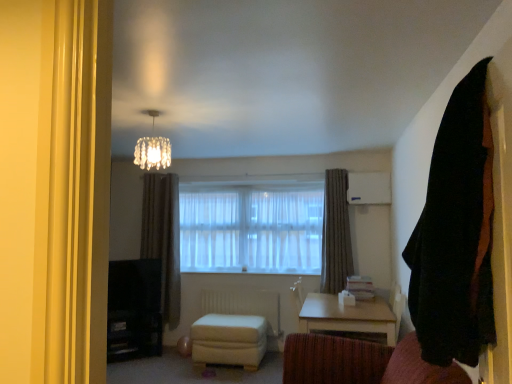
Question: Is white plastic radiator at lower center next to white sheer curtains at center and touching it?

Choices:
 (A) no
 (B) yes

Answer: (A)

Question: Considering the relative sizes of white plastic radiator at lower center and white sheer curtains at center in the image provided, is white plastic radiator at lower center taller than white sheer curtains at center?

Choices:
 (A) yes
 (B) no

Answer: (B)

Question: From a real-world perspective, is white plastic radiator at lower center located higher than white sheer curtains at center?

Choices:
 (A) no
 (B) yes

Answer: (A)

Question: Considering the relative sizes of white plastic radiator at lower center and white sheer curtains at center in the image provided, is white plastic radiator at lower center thinner than white sheer curtains at center?

Choices:
 (A) yes
 (B) no

Answer: (A)

Question: Does white plastic radiator at lower center turn towards white sheer curtains at center?

Choices:
 (A) no
 (B) yes

Answer: (A)

Question: From a real-world perspective, is gray textured curtain at center, the second curtain in the front-to-back sequence, above or below dark gray textured curtain at left, placed as the first curtain when sorted from back to front?

Choices:
 (A) below
 (B) above

Answer: (B)

Question: Based on their positions, is gray textured curtain at center, the second curtain in the front-to-back sequence, located to the left or right of dark gray textured curtain at left, the 3th curtain in the front-to-back sequence?

Choices:
 (A) right
 (B) left

Answer: (A)

Question: In the image, is gray textured curtain at center, which is the 1th curtain in right-to-left order, positioned in front of or behind dark gray textured curtain at left, the 3th curtain in the front-to-back sequence?

Choices:
 (A) behind
 (B) front

Answer: (B)

Question: From the image's perspective, is gray textured curtain at center, which is the 1th curtain in right-to-left order, positioned above or below dark gray textured curtain at left, the third curtain from the right?

Choices:
 (A) above
 (B) below

Answer: (A)

Question: From the image's perspective, is white leather stool at center positioned above or below black fabric curtain at right, the second curtain when ordered from left to right?

Choices:
 (A) below
 (B) above

Answer: (A)

Question: Considering the positions of white leather stool at center and black fabric curtain at right, the second curtain viewed from the right, in the image, is white leather stool at center bigger or smaller than black fabric curtain at right, the second curtain viewed from the right,?

Choices:
 (A) big
 (B) small

Answer: (A)

Question: Based on their positions, is white leather stool at center located to the left or right of black fabric curtain at right, the second curtain viewed from the right?

Choices:
 (A) right
 (B) left

Answer: (B)

Question: From a real-world perspective, is white leather stool at center positioned above or below black fabric curtain at right, the second curtain viewed from the right?

Choices:
 (A) above
 (B) below

Answer: (B)

Question: From a real-world perspective, is light wood/texture table at lower center physically located above or below crystal glass chandelier at upper center?

Choices:
 (A) below
 (B) above

Answer: (A)

Question: Considering the relative positions of light wood/texture table at lower center and crystal glass chandelier at upper center in the image provided, is light wood/texture table at lower center to the left or to the right of crystal glass chandelier at upper center?

Choices:
 (A) left
 (B) right

Answer: (B)